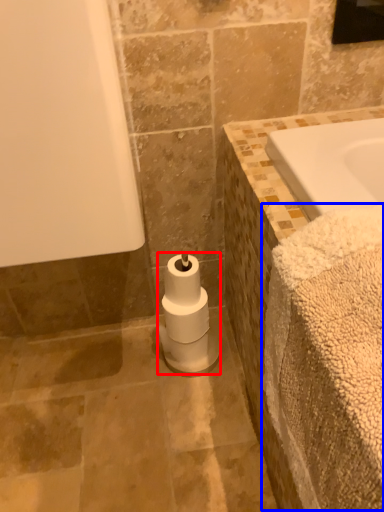
Question: Which of the following is the farthest to the observer, toilet paper (highlighted by a red box) or bath towel (highlighted by a blue box)?

Choices:
 (A) toilet paper
 (B) bath towel

Answer: (A)